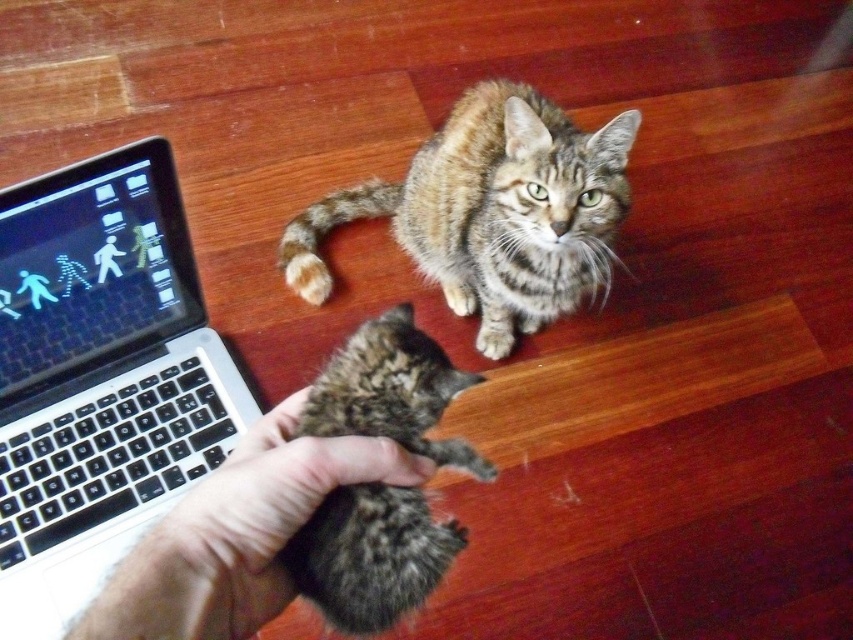
Based on the provided scene description, where is the tabby fur cat at center located in the image?

The tabby fur cat at center is located at point coordinates of (491, 209).

Looking at this image, you are a cat owner who wants to place a small toy between the fur at center and the soft brown fur paw at center. Which object should you place the toy closer to to ensure it fits within the space?

A: The soft brown fur paw at center is smaller in width than the fur at center, so placing the toy closer to the soft brown fur paw at center would ensure it fits within the space.

Looking at the image of the cozy indoor scene with the two cats and the laptop, can you determine if the fur at center is positioned to the left or right of the soft brown fur paw at center?

The fur at center is to the left of the soft brown fur paw at center.